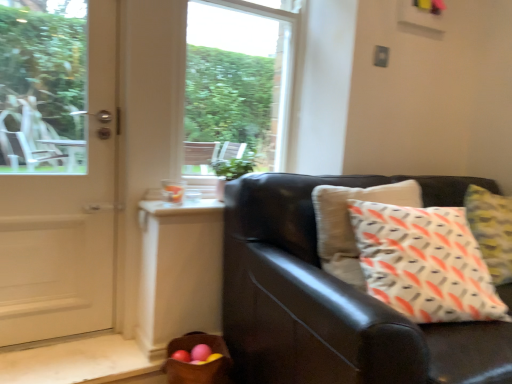
Describe the element at coordinates (237, 83) in the screenshot. Image resolution: width=512 pixels, height=384 pixels. I see `transparent glass window at center` at that location.

Based on the photo, measure the distance between brown woven basket at lower left and camera.

They are 4.51 feet apart.

Locate an element on the screen. transparent glass window at center is located at coordinates (237, 83).

Is transparent glass window at center inside or outside of brown woven basket at lower left?

A: transparent glass window at center is outside brown woven basket at lower left.

Is transparent glass window at center shorter than brown woven basket at lower left?

No.

Is transparent glass window at center touching brown woven basket at lower left?

There is a gap between transparent glass window at center and brown woven basket at lower left.

From a real-world perspective, between transparent glass window at center and brown woven basket at lower left, who is vertically lower?

brown woven basket at lower left is physically lower.

Does point (42, 275) come behind point (205, 46)?

No, it is in front of (205, 46).

Locate an element on the screen. The height and width of the screenshot is (384, 512). window on the right of the white glossy door at left is located at coordinates (237, 83).

From a real-world perspective, is white glossy door at left positioned above or below transparent glass window at center?

white glossy door at left is situated lower than transparent glass window at center in the real world.

Is transparent glass window at center surrounded by white glossy door at left?

No, transparent glass window at center is not surrounded by white glossy door at left.

Consider the image. In the image, is white glossy door at left on the left side or the right side of brown woven basket at lower left?

In the image, white glossy door at left appears on the left side of brown woven basket at lower left.

Measure the distance between white glossy door at left and brown woven basket at lower left.

The distance of white glossy door at left from brown woven basket at lower left is 24.03 inches.

Identify the location of door that is in front of the brown woven basket at lower left. The width and height of the screenshot is (512, 384). (64, 222).

Is white glossy door at left facing away from brown woven basket at lower left?

No, white glossy door at left is not facing away from brown woven basket at lower left.

Which is in front, point (265, 213) or point (187, 345)?

The point (265, 213) is closer.

From the image's perspective, is matte black couch at right beneath brown woven basket at lower left?

No, from the image's perspective, matte black couch at right is not below brown woven basket at lower left.

Where is `basket that is under the matte black couch at right (from a real-world perspective)`? This screenshot has height=384, width=512. basket that is under the matte black couch at right (from a real-world perspective) is located at coordinates (199, 365).

Between matte black couch at right and brown woven basket at lower left, which one has smaller size?

With smaller size is brown woven basket at lower left.

Where is `studio couch below the transparent glass window at center (from the image's perspective)`? The width and height of the screenshot is (512, 384). studio couch below the transparent glass window at center (from the image's perspective) is located at coordinates (334, 298).

Is matte black couch at right outside of transparent glass window at center?

Yes, matte black couch at right is outside of transparent glass window at center.

Based on the photo, does matte black couch at right come in front of transparent glass window at center?

Yes, matte black couch at right is closer to the viewer.

From a real-world perspective, is matte black couch at right on transparent glass window at center?

Actually, matte black couch at right is physically below transparent glass window at center in the real world.

Would you say transparent glass window at center is a long distance from matte black couch at right?

No, transparent glass window at center is in close proximity to matte black couch at right.

Does transparent glass window at center have a greater height compared to matte black couch at right?

Indeed, transparent glass window at center has a greater height compared to matte black couch at right.

From the image's perspective, between transparent glass window at center and matte black couch at right, who is located below?

matte black couch at right.

Is transparent glass window at center at the left side of matte black couch at right?

Indeed, transparent glass window at center is positioned on the left side of matte black couch at right.

From the image's perspective, which one is positioned higher, transparent glass window at center or white glossy door at left?

transparent glass window at center, from the image's perspective.

Considering the points (287, 34) and (99, 88), which point is behind, point (287, 34) or point (99, 88)?

The point (287, 34) is farther.

From a real-world perspective, is transparent glass window at center beneath white glossy door at left?

Actually, transparent glass window at center is physically above white glossy door at left in the real world.

Identify the location of window that is behind the brown woven basket at lower left. The height and width of the screenshot is (384, 512). (237, 83).

This screenshot has height=384, width=512. What are the coordinates of `door below the transparent glass window at center (from the image's perspective)` in the screenshot? It's located at (64, 222).

Which object lies nearer to the anchor point matte black couch at right, brown woven basket at lower left or white glossy door at left?

brown woven basket at lower left.

When comparing their distances from white glossy door at left, does brown woven basket at lower left or matte black couch at right seem further?

matte black couch at right.

Which object lies further to the anchor point brown woven basket at lower left, white glossy door at left or transparent glass window at center?

The object further to brown woven basket at lower left is transparent glass window at center.

Estimate the real-world distances between objects in this image. Which object is closer to brown woven basket at lower left, transparent glass window at center or matte black couch at right?

matte black couch at right lies closer to brown woven basket at lower left than the other object.

Based on their spatial positions, is transparent glass window at center or white glossy door at left further from brown woven basket at lower left?

Among the two, transparent glass window at center is located further to brown woven basket at lower left.

Which object lies further to the anchor point brown woven basket at lower left, matte black couch at right or transparent glass window at center?

The object further to brown woven basket at lower left is transparent glass window at center.

Looking at the image, which one is located further to transparent glass window at center, matte black couch at right or white glossy door at left?

matte black couch at right.

From the image, which object appears to be nearer to transparent glass window at center, white glossy door at left or brown woven basket at lower left?

Among the two, white glossy door at left is located nearer to transparent glass window at center.

Locate an element on the screen. The height and width of the screenshot is (384, 512). door between transparent glass window at center and brown woven basket at lower left from top to bottom is located at coordinates (64, 222).

Identify the location of studio couch between transparent glass window at center and brown woven basket at lower left from top to bottom. (334, 298).

This screenshot has width=512, height=384. Find the location of `window located between white glossy door at left and matte black couch at right in the left-right direction`. window located between white glossy door at left and matte black couch at right in the left-right direction is located at coordinates (237, 83).

The height and width of the screenshot is (384, 512). In order to click on basket between white glossy door at left and matte black couch at right in this screenshot , I will do `click(199, 365)`.